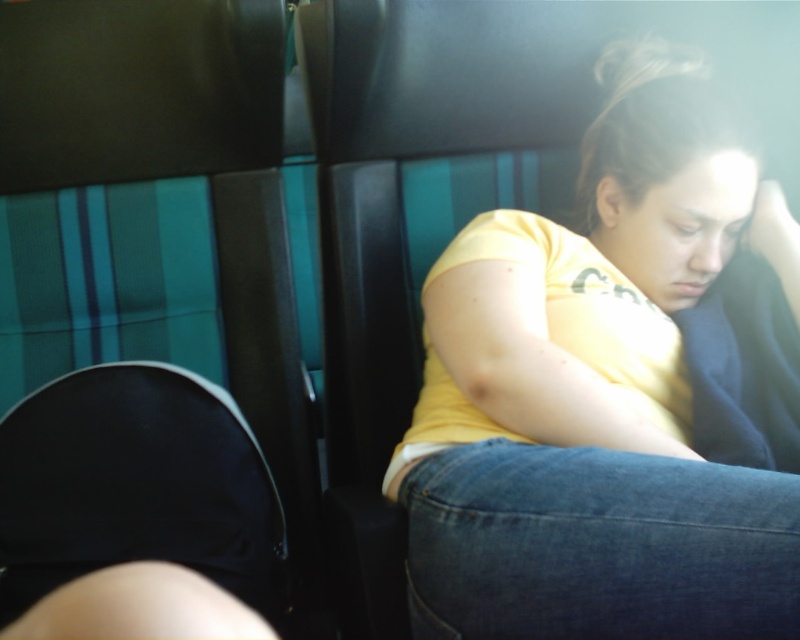
At what (x,y) coordinates should I click in order to perform the action: click on yellow cotton shirt at center. Please return your answer as a coordinate pair (x, y). Image resolution: width=800 pixels, height=640 pixels. Looking at the image, I should click on (598, 394).

Where is `yellow cotton shirt at center`? The height and width of the screenshot is (640, 800). yellow cotton shirt at center is located at coordinates (598, 394).